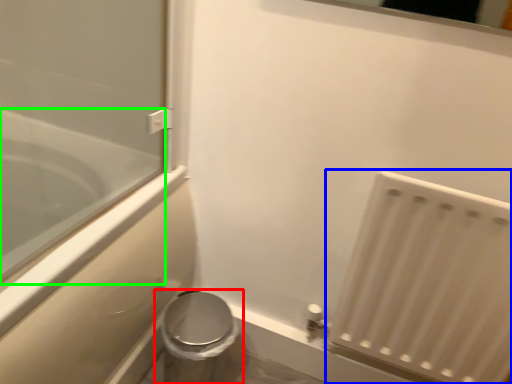
Question: Estimate the real-world distances between objects in this image. Which object is farther from toilet (highlighted by a red box), radiator (highlighted by a blue box) or bathtub (highlighted by a green box)?

Choices:
 (A) radiator
 (B) bathtub

Answer: (A)